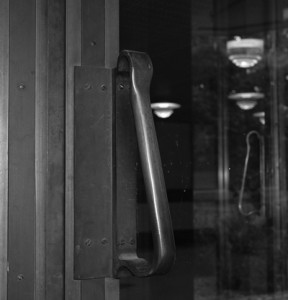
Locate an element on the screen. Image resolution: width=288 pixels, height=300 pixels. light is located at coordinates (259, 96), (247, 57), (168, 112).